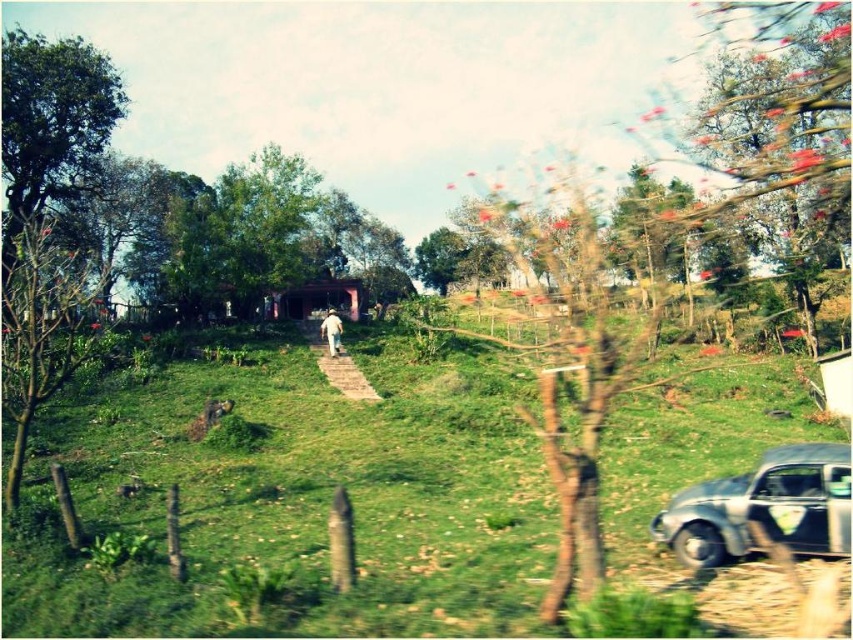
You are a photographer planning to take a landscape shot of the scene. You want to include both the pink flowered tree at upper right and the green leafy tree at center in your frame. Considering their heights, which tree should you position closer to the center of the photo to balance the composition?

The pink flowered tree at upper right is taller than the green leafy tree at center. To balance the composition, position the taller pink flowered tree at upper right closer to the center of the photo so its height doesn

You are standing at the center of the scene and see the green grassy at center and the white cotton hat at center. How far apart are these two objects from each other?

The green grassy at center and the white cotton hat at center are 34.41 feet apart.

You are a landscape architect designing a garden path that needs to pass between the pink flowered tree at upper right and the green leafy tree at center. Considering their sizes, which tree should the path be closer to to ensure enough space for visitors to walk comfortably?

The path should be closer to the green leafy tree at center because the pink flowered tree at upper right has a larger size, requiring more space around it for visitors to walk comfortably.